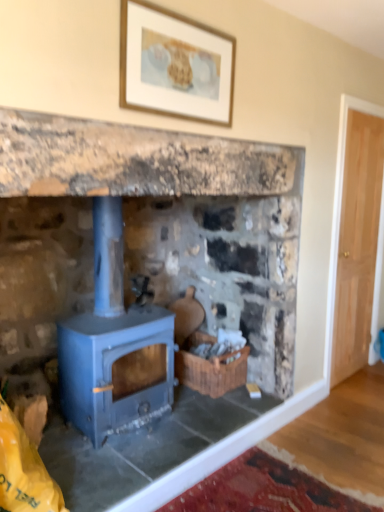
This screenshot has height=512, width=384. Find the location of `blue matte wood stove at center`. blue matte wood stove at center is located at coordinates (151, 259).

The image size is (384, 512). What do you see at coordinates (212, 371) in the screenshot? I see `woven brown basket at center` at bounding box center [212, 371].

The height and width of the screenshot is (512, 384). In order to click on blue matte wood stove at center in this screenshot , I will do `click(151, 259)`.

Is blue matte wood stove at center at the right side of woven brown basket at center?

No.

Which of these two, blue matte wood stove at center or woven brown basket at center, is smaller?

woven brown basket at center.

From the image's perspective, between blue matte wood stove at center and woven brown basket at center, who is located below?

woven brown basket at center appears lower in the image.

Identify the location of fireplace to the left of woven brown basket at center. The image size is (384, 512). (151, 259).

From the image's perspective, would you say woven brown basket at center is positioned over wooden framed artwork at upper center?

Actually, woven brown basket at center appears below wooden framed artwork at upper center in the image.

From a real-world perspective, is woven brown basket at center over wooden framed artwork at upper center?

No, from a real-world perspective, woven brown basket at center is not on top of wooden framed artwork at upper center.

Is woven brown basket at center inside the boundaries of wooden framed artwork at upper center, or outside?

woven brown basket at center is not enclosed by wooden framed artwork at upper center.

How many degrees apart are the facing directions of woven brown basket at center and wooden framed artwork at upper center?

1.95 degrees.

How many degrees apart are the facing directions of wooden framed artwork at upper center and blue matte wood burning stove at center?

They differ by 0.683 degrees in their facing directions.

Is wooden framed artwork at upper center completely or partially outside of blue matte wood burning stove at center?

Yes, wooden framed artwork at upper center is outside of blue matte wood burning stove at center.

Measure the distance between wooden framed artwork at upper center and blue matte wood burning stove at center.

The distance of wooden framed artwork at upper center from blue matte wood burning stove at center is 1.01 meters.

Does wooden framed artwork at upper center have a lesser height compared to blue matte wood burning stove at center?

Yes, wooden framed artwork at upper center is shorter than blue matte wood burning stove at center.

Between woven brown basket at center and blue matte wood stove at center, which one appears on the left side from the viewer's perspective?

Positioned to the left is blue matte wood stove at center.

From a real-world perspective, is woven brown basket at center physically located above or below blue matte wood stove at center?

woven brown basket at center is below blue matte wood stove at center.

This screenshot has width=384, height=512. Identify the location of basket that is under the blue matte wood stove at center (from a real-world perspective). (212, 371).

Which is correct: wooden framed artwork at upper center is inside blue matte wood stove at center, or outside of it?

wooden framed artwork at upper center is not inside blue matte wood stove at center, it's outside.

Is wooden framed artwork at upper center in contact with blue matte wood stove at center?

No, wooden framed artwork at upper center is not beside blue matte wood stove at center.

From a real-world perspective, is wooden framed artwork at upper center over blue matte wood stove at center?

Yes, from a real-world perspective, wooden framed artwork at upper center is on top of blue matte wood stove at center.

Is point (192, 344) closer to viewer compared to point (98, 267)?

No, (192, 344) is further to viewer.

Is woven brown basket at center far from blue matte wood burning stove at center?

They are positioned close to each other.

Would you say woven brown basket at center is to the left or to the right of blue matte wood burning stove at center in the picture?

Based on their positions, woven brown basket at center is located to the right of blue matte wood burning stove at center.

Would you say blue matte wood burning stove at center is part of woven brown basket at center's contents?

No, woven brown basket at center does not contain blue matte wood burning stove at center.

Does blue matte wood stove at center have a greater width compared to blue matte wood burning stove at center?

Correct, the width of blue matte wood stove at center exceeds that of blue matte wood burning stove at center.

Is blue matte wood stove at center to the right of blue matte wood burning stove at center from the viewer's perspective?

Yes, blue matte wood stove at center is to the right of blue matte wood burning stove at center.

Is blue matte wood stove at center touching blue matte wood burning stove at center?

No, blue matte wood stove at center is not making contact with blue matte wood burning stove at center.

Find the location of a particular element. basket that is below the blue matte wood stove at center (from the image's perspective) is located at coordinates (212, 371).

Where is `basket that is behind the wooden framed artwork at upper center`? basket that is behind the wooden framed artwork at upper center is located at coordinates (212, 371).

Based on the photo, when comparing their distances from woven brown basket at center, does blue matte wood burning stove at center or blue matte wood stove at center seem further?

Among the two, blue matte wood burning stove at center is located further to woven brown basket at center.

Which object lies nearer to the anchor point blue matte wood stove at center, wooden framed artwork at upper center or woven brown basket at center?

woven brown basket at center is positioned closer to the anchor blue matte wood stove at center.

Looking at the image, which one is located further to blue matte wood burning stove at center, woven brown basket at center or wooden framed artwork at upper center?

The object further to blue matte wood burning stove at center is wooden framed artwork at upper center.

Looking at the image, which one is located closer to blue matte wood stove at center, wooden framed artwork at upper center or blue matte wood burning stove at center?

Among the two, blue matte wood burning stove at center is located nearer to blue matte wood stove at center.

Which object lies nearer to the anchor point woven brown basket at center, blue matte wood stove at center or blue matte wood burning stove at center?

blue matte wood stove at center.

Looking at the image, which one is located further to blue matte wood stove at center, blue matte wood burning stove at center or woven brown basket at center?

Based on the image, woven brown basket at center appears to be further to blue matte wood stove at center.

Considering their positions, is wooden framed artwork at upper center positioned closer to blue matte wood burning stove at center than woven brown basket at center?

Among the two, woven brown basket at center is located nearer to blue matte wood burning stove at center.

Looking at the image, which one is located closer to blue matte wood burning stove at center, woven brown basket at center or blue matte wood stove at center?

blue matte wood stove at center is positioned closer to the anchor blue matte wood burning stove at center.

Find the location of `fireplace between wooden framed artwork at upper center and woven brown basket at center in the up-down direction`. fireplace between wooden framed artwork at upper center and woven brown basket at center in the up-down direction is located at coordinates (151, 259).

Find the location of a particular element. The height and width of the screenshot is (512, 384). wood burning stove positioned between blue matte wood stove at center and woven brown basket at center from near to far is located at coordinates (113, 344).

Identify the location of fireplace between wooden framed artwork at upper center and blue matte wood burning stove at center vertically. (151, 259).

I want to click on wood burning stove that lies between wooden framed artwork at upper center and woven brown basket at center from top to bottom, so click(113, 344).